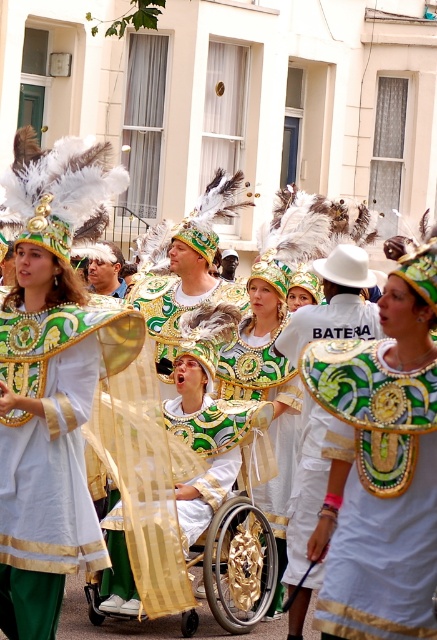
You are a photographer trying to capture a clear photo of both the matte gold and green costume at center and the gold metallic wheelchair at center. Which object should you focus on first to ensure both are in focus?

You should focus on the matte gold and green costume at center first because it is closer to the viewer than the gold metallic wheelchair at center. By focusing on the closer object, the depth of field may also keep the farther object in focus.

You are a photographer trying to capture the entire scene of the parade. You notice the matte gold and green costume at center and the gold metallic wheelchair at center. Which object is wider so that you can adjust your camera angle accordingly?

The matte gold and green costume at center is wider than the gold metallic wheelchair at center, so you should adjust your camera angle to accommodate its width.